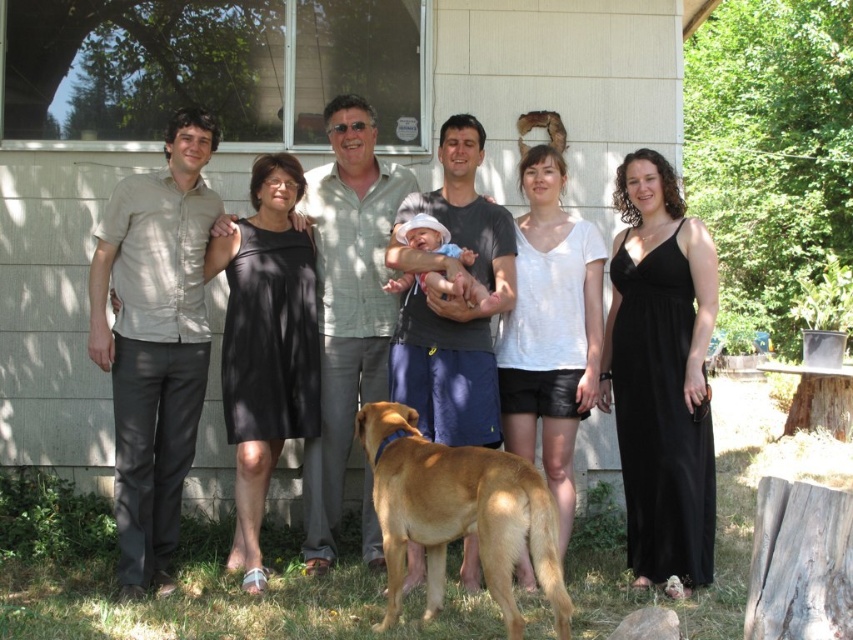
Question: Which point is closer to the camera?

Choices:
 (A) golden fur dog at lower center
 (B) matte black dress at center

Answer: (A)

Question: Which object is positioned farthest from the soft pink fabric baby at center?

Choices:
 (A) matte black dress at center
 (B) golden fur dog at lower center

Answer: (B)

Question: Does matte black dress at center have a larger size compared to soft pink fabric baby at center?

Choices:
 (A) yes
 (B) no

Answer: (A)

Question: Is the position of golden fur dog at lower center more distant than that of soft pink fabric baby at center?

Choices:
 (A) yes
 (B) no

Answer: (B)

Question: In this image, where is matte black dress at center located relative to soft pink fabric baby at center?

Choices:
 (A) below
 (B) above

Answer: (A)

Question: Which object is closer to the camera taking this photo?

Choices:
 (A) matte black dress at center
 (B) golden fur dog at lower center
 (C) soft pink fabric baby at center

Answer: (B)